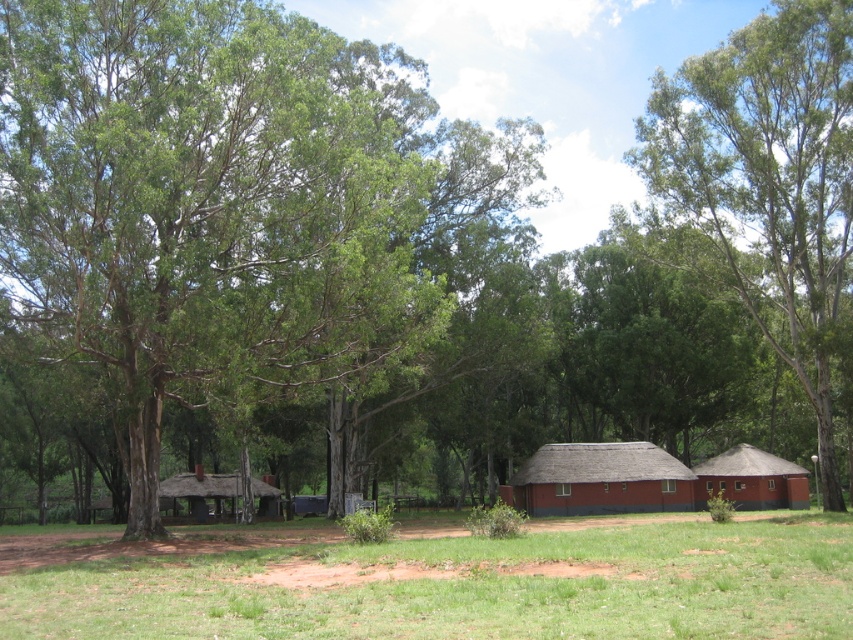
You are standing in the middle of the grassy area and want to walk towards the green leafy tree at upper right. Which direction should you walk to avoid the green grass at lower center?

To avoid the green grass at lower center, you should walk towards the green leafy tree at upper right while moving to the side of the grass. Since the green grass at lower center is in front of the tree, walking around it to the left or right would allow you to reach the tree without stepping on the grass.

You are a hiker who has just arrived at this serene outdoor scene. You need to find a spot to set up your tent. The tent requires a flat area with grass and must be placed below a tree for shade. Can you determine if the green grass at lower center and the green leafy tree at upper right meet these requirements?

The green grass at lower center is located below the green leafy tree at upper right, so yes, the green grass at lower center meets the requirement of being below the tree and provides a suitable flat area for the tent with grass and shade.